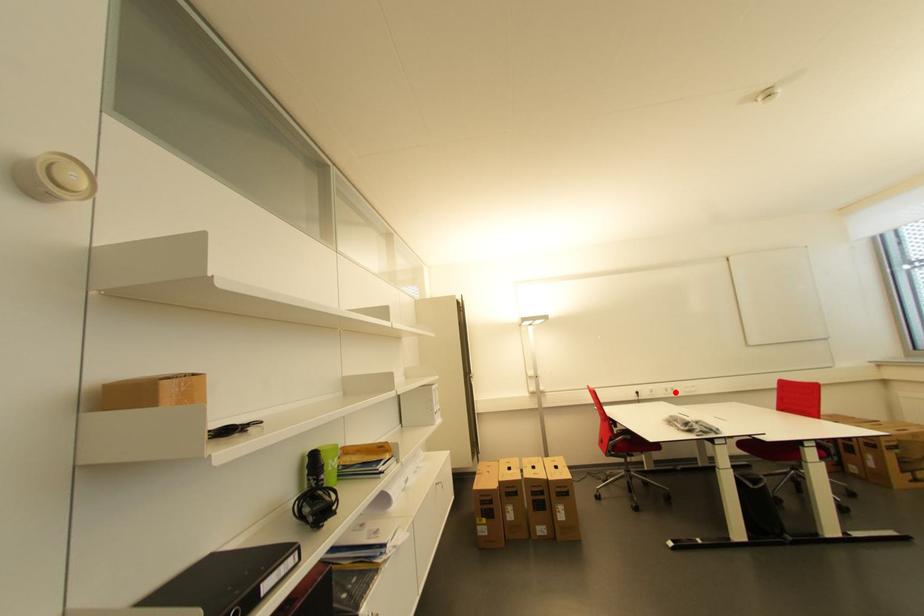
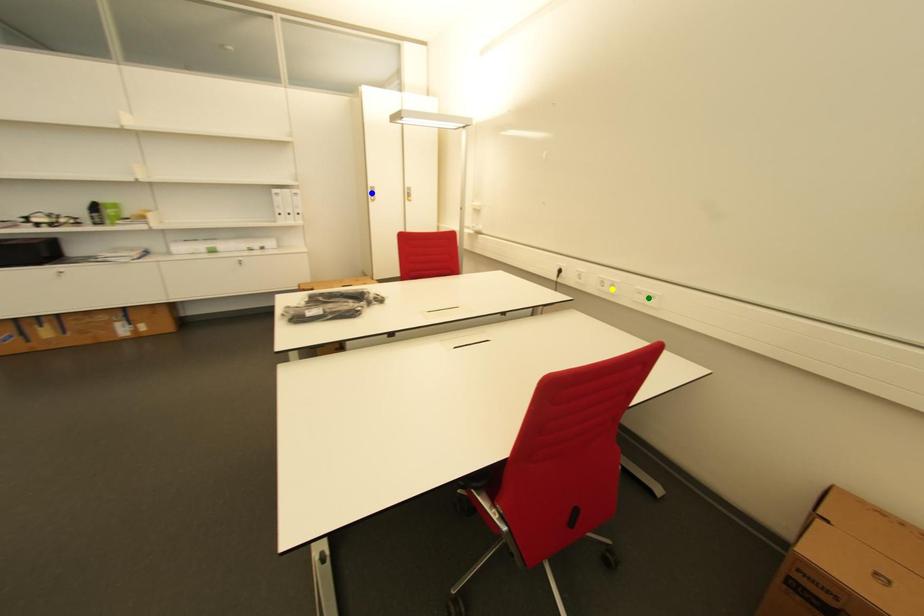
Question: I am providing you with two images of the same scene from different viewpoints. A red point is marked on the first image. You are given multiple points on the second image. Which point in image 2 is actually the same real-world point as the red point in image 1?

Choices:
 (A) blue point
 (B) yellow point
 (C) green point

Answer: (B)